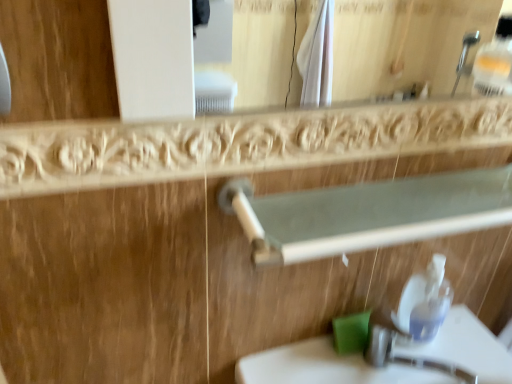
Question: Is transparent plastic soap dispenser at lower right to the left or to the right of green matte soap at lower center in the image?

Choices:
 (A) left
 (B) right

Answer: (B)

Question: Is point (430, 289) positioned closer to the camera than point (361, 352)?

Choices:
 (A) closer
 (B) farther

Answer: (A)

Question: Based on their relative distances, which object is nearer to the green matte soap at lower center?

Choices:
 (A) white plastic rail at upper center
 (B) white glossy sink at lower center
 (C) transparent plastic soap dispenser at lower right

Answer: (C)

Question: Considering the real-world distances, which object is farthest from the white plastic rail at upper center?

Choices:
 (A) white glossy sink at lower center
 (B) green matte soap at lower center
 (C) transparent plastic soap dispenser at lower right

Answer: (B)